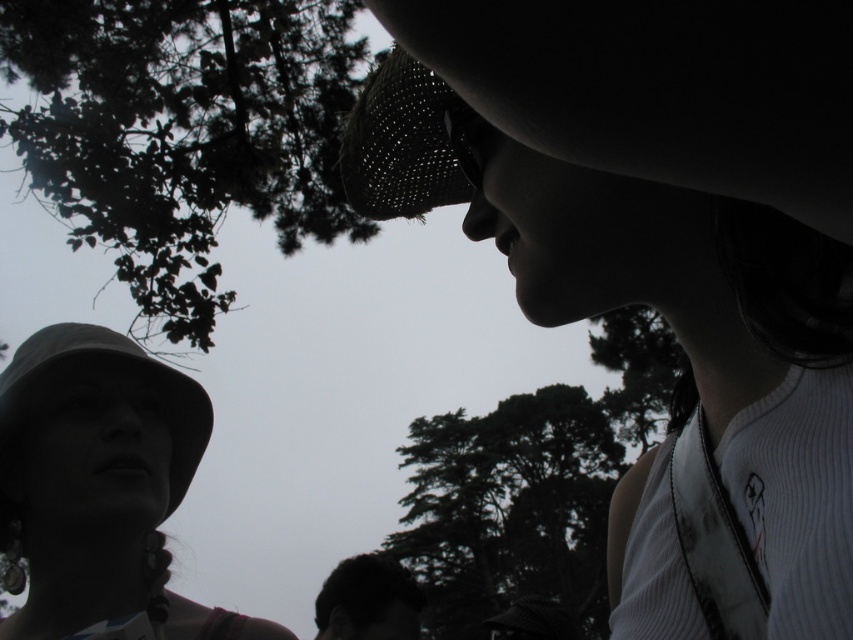
You are a photographer trying to capture a closeup of the matte white hat at upper right and the black mesh hat at upper center. Which hat should you zoom in on if you want to focus on the wider one?

The matte white hat at upper right is wider than the black mesh hat at upper center, so you should zoom in on the matte white hat at upper right to focus on the wider one.